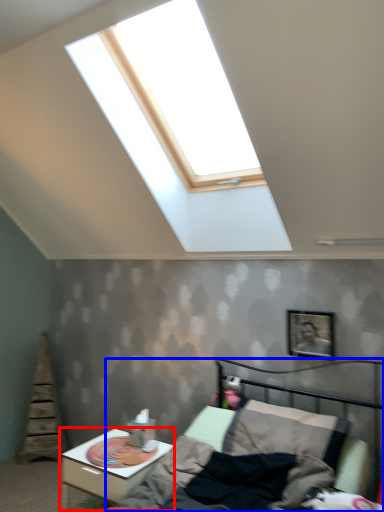
Question: Which object is closer to the camera taking this photo, nightstand (highlighted by a red box) or bed (highlighted by a blue box)?

Choices:
 (A) nightstand
 (B) bed

Answer: (B)